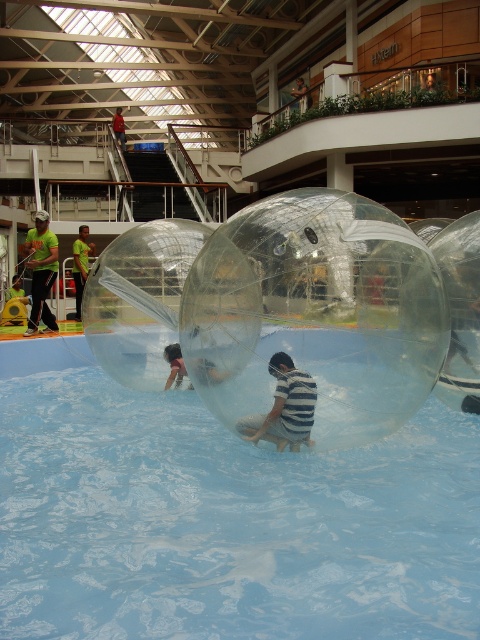
You are standing at the edge of the transparent plastic swimming pool at center. You want to reach the point marked at point (222, 518). Is this point located inside the pool?

The point marked at point (222, 518) is exactly where the transparent plastic swimming pool at center is located, so yes, the point is inside the pool.